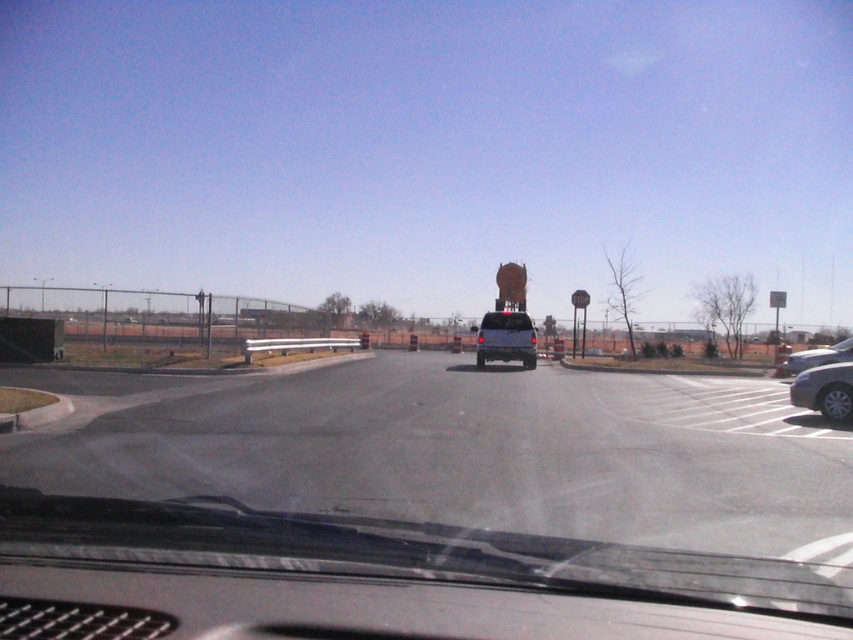
You are inside a vehicle and want to check if the transparent glass windshield at center is obstructing your view of the white pickup truck driving away. Based on its position, can you see the truck clearly through the windshield?

The transparent glass windshield at center is located at point (434, 502), which is likely in the central area of the vehicle, allowing you to see the white pickup truck driving away clearly through it since windshields are designed for clear forward visibility.

You are a passenger in the vehicle and looking out the transparent glass windshield at center. You notice a silver metallic sedan at right parked nearby. Can you determine which object takes up more space in your field of view?

The silver metallic sedan at right takes up more space in the field of view because the transparent glass windshield at center occupies less space than the silver metallic sedan at right.